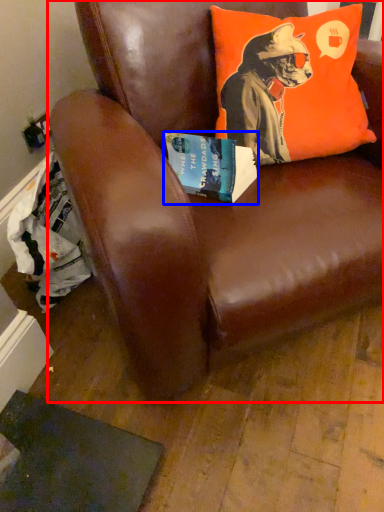
Question: Among these objects, which one is farthest to the camera, chair (highlighted by a red box) or book (highlighted by a blue box)?

Choices:
 (A) chair
 (B) book

Answer: (B)